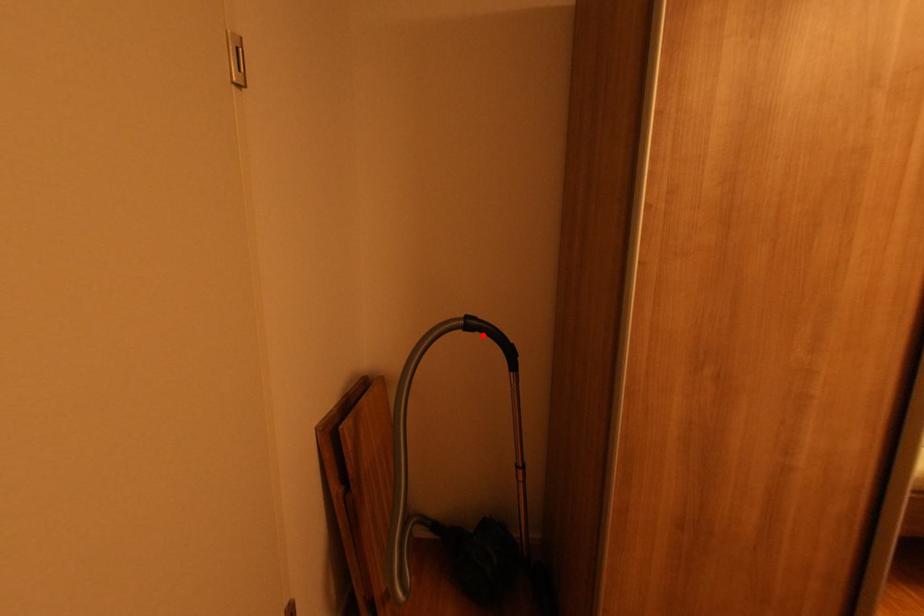
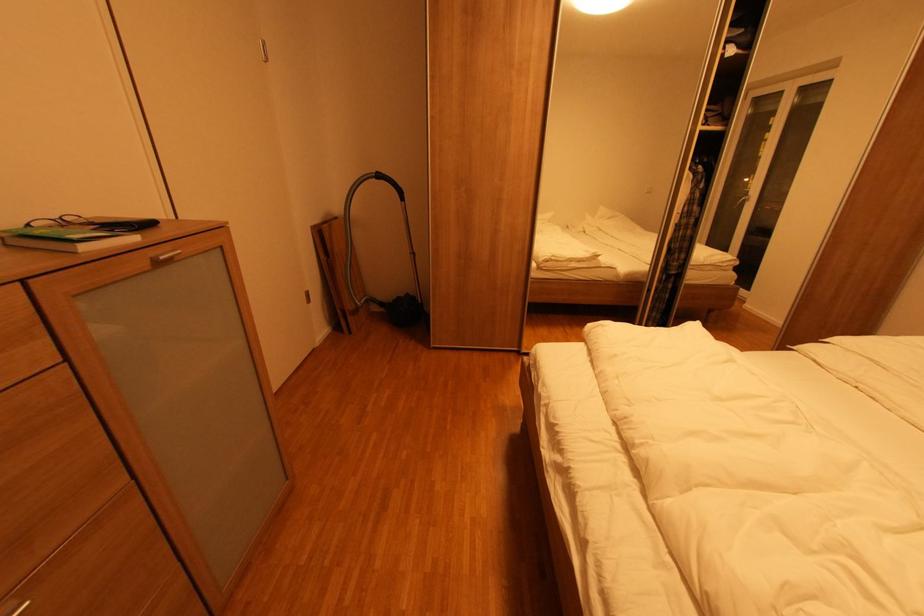
Locate, in the second image, the point that corresponds to the highlighted location in the first image.

(387, 182)